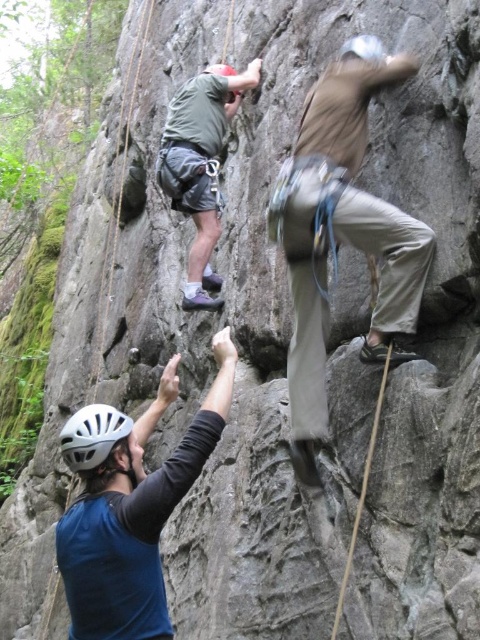
Question: Among these points, which one is farthest from the camera?

Choices:
 (A) pyautogui.click(x=96, y=420)
 (B) pyautogui.click(x=307, y=120)

Answer: (B)

Question: Is green fabric shirt at upper center thinner than white matte helmet at lower left?

Choices:
 (A) yes
 (B) no

Answer: (A)

Question: Which object is closer to the camera taking this photo?

Choices:
 (A) khaki cotton pants at center
 (B) green fabric shirt at upper center
 (C) white matte helmet at lower left

Answer: (C)

Question: Can you confirm if khaki cotton pants at center is positioned below white matte helmet at lower left?

Choices:
 (A) yes
 (B) no

Answer: (B)

Question: Among these objects, which one is farthest from the camera?

Choices:
 (A) khaki cotton pants at center
 (B) green fabric shirt at upper center
 (C) white matte helmet at lower left

Answer: (B)

Question: Considering the relative positions of green fabric shirt at upper center and white matte helmet at lower left in the image provided, where is green fabric shirt at upper center located with respect to white matte helmet at lower left?

Choices:
 (A) below
 (B) above

Answer: (B)